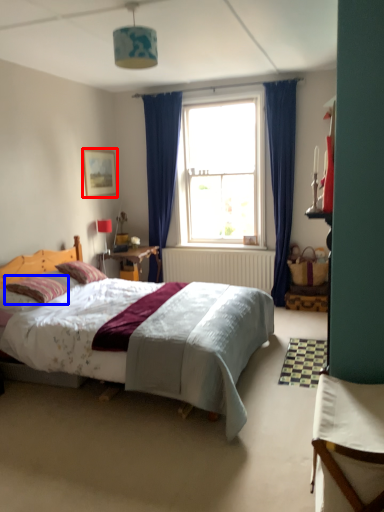
Question: Which point is closer to the camera, picture frame (highlighted by a red box) or pillow (highlighted by a blue box)?

Choices:
 (A) picture frame
 (B) pillow

Answer: (B)